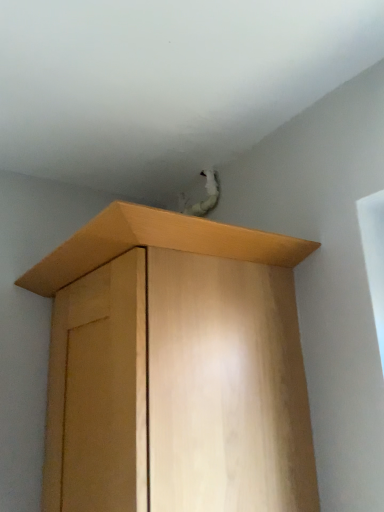
What do you see at coordinates (161, 247) in the screenshot? I see `light wood cupboard at upper center` at bounding box center [161, 247].

At what (x,y) coordinates should I click in order to perform the action: click on light wood cupboard at upper center. Please return your answer as a coordinate pair (x, y). The image size is (384, 512). Looking at the image, I should click on (161, 247).

Where is `light wood cupboard at upper center`? The image size is (384, 512). light wood cupboard at upper center is located at coordinates (161, 247).